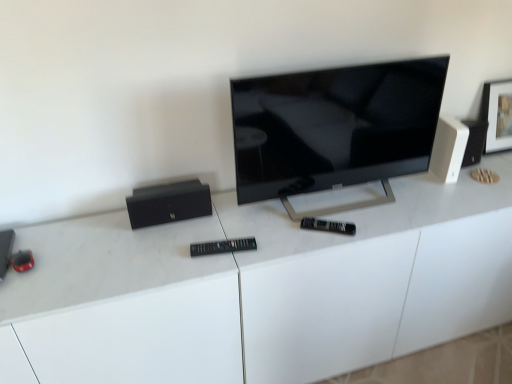
Question: Choose the correct answer: Is black matte speaker at left, positioned as the 2th speaker in right-to-left order, inside black plastic remote at center or outside it?

Choices:
 (A) outside
 (B) inside

Answer: (A)

Question: Does point (183, 213) appear closer or farther from the camera than point (219, 249)?

Choices:
 (A) closer
 (B) farther

Answer: (B)

Question: Which object is the closest to the metallic black speaker at left, the 1th speaker when ordered from left to right?

Choices:
 (A) white plastic speaker at upper right, the first speaker in the top-to-bottom sequence
 (B) black matte speaker at left, acting as the 2th speaker starting from the top
 (C) black glossy tv at center
 (D) black plastic remote at center
 (E) white glossy desk at center

Answer: (B)

Question: Considering the real-world distances, which object is farthest from the black plastic remote at center?

Choices:
 (A) black matte speaker at left, positioned as the 2th speaker in right-to-left order
 (B) white plastic speaker at upper right, marked as the third speaker in a bottom-to-top arrangement
 (C) white glossy desk at center
 (D) metallic black speaker at left, positioned as the 1th speaker in bottom-to-top order
 (E) black glossy tv at center

Answer: (B)